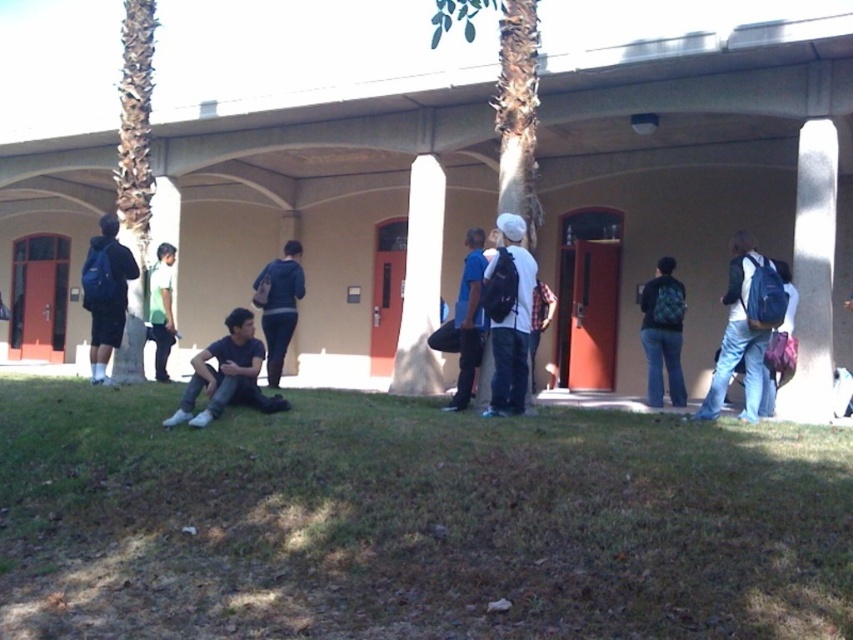
Which is in front, point (257, 344) or point (432, 346)?

Positioned in front is point (257, 344).

Can you confirm if dark blue jeans at lower left is positioned above blue backpack at center?

Actually, dark blue jeans at lower left is below blue backpack at center.

At what (x,y) coordinates should I click in order to perform the action: click on dark blue jeans at lower left. Please return your answer as a coordinate pair (x, y). The height and width of the screenshot is (640, 853). Looking at the image, I should click on (227, 374).

Is brown textured palm tree at left below matte black backpack at center right?

No.

Is brown textured palm tree at left above matte black backpack at center right?

Correct, brown textured palm tree at left is located above matte black backpack at center right.

Does point (135, 342) come behind point (663, 273)?

That is False.

This screenshot has height=640, width=853. Identify the location of brown textured palm tree at left. (134, 173).

What do you see at coordinates (412, 522) in the screenshot? The image size is (853, 640). I see `green grass at lower left` at bounding box center [412, 522].

Who is higher up, green grass at lower left or green fabric shirt at center?

Positioned higher is green fabric shirt at center.

Find the location of a particular element. The height and width of the screenshot is (640, 853). green grass at lower left is located at coordinates (412, 522).